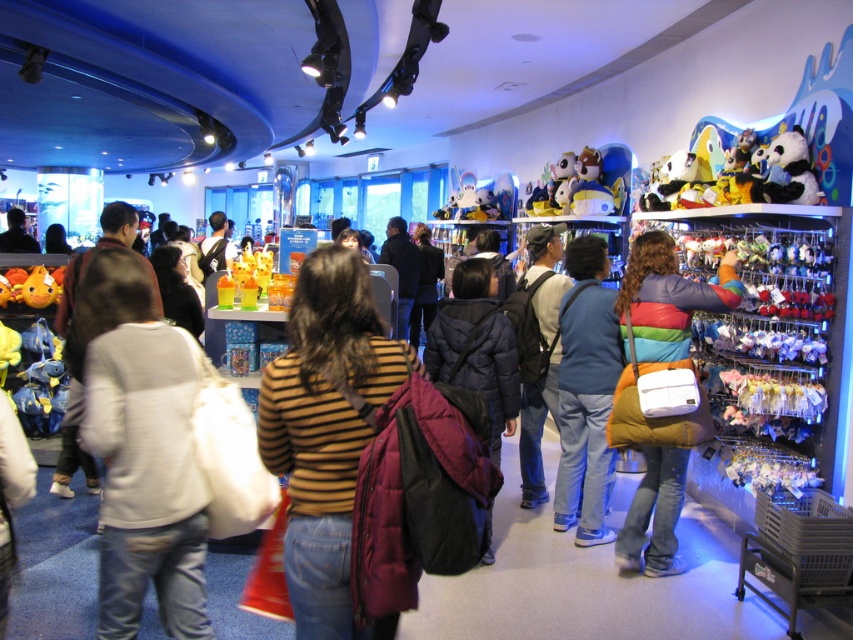
Question: Which point appears farthest from the camera in this image?

Choices:
 (A) (569, 449)
 (B) (500, 317)
 (C) (125, 225)

Answer: (A)

Question: Which object appears closest to the camera in this image?

Choices:
 (A) soft plush toys at upper right
 (B) striped sweater at center
 (C) white cotton sweater at center

Answer: (C)

Question: Among these points, which one is farthest from the camera?

Choices:
 (A) (503, 397)
 (B) (688, 188)
 (C) (148, 445)
 (D) (550, 380)

Answer: (B)

Question: Does dark brown backpack at center appear over striped sweater at center?

Choices:
 (A) yes
 (B) no

Answer: (B)

Question: In this image, where is dark blue puffer jacket at center located relative to dark brown backpack at center?

Choices:
 (A) above
 (B) below

Answer: (A)

Question: Observing the image, what is the correct spatial positioning of white cotton sweater at center in reference to soft plush toys at upper right?

Choices:
 (A) below
 (B) above

Answer: (A)